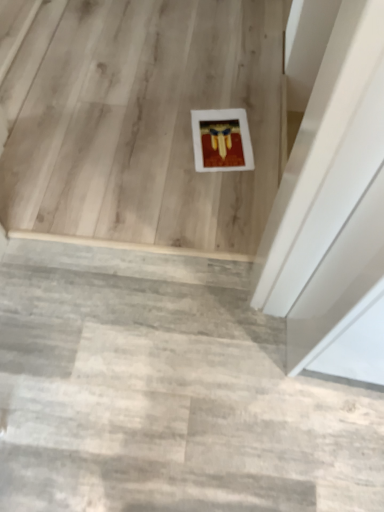
Question: Is concrete textured stairs at center, the 1th stairwell positioned from the bottom, far from white matte frame at center, acting as the first stairwell starting from the back?

Choices:
 (A) yes
 (B) no

Answer: (B)

Question: Does concrete textured stairs at center, the 1th stairwell positioned from the bottom, have a greater height compared to white matte frame at center, positioned as the 1th stairwell in top-to-bottom order?

Choices:
 (A) no
 (B) yes

Answer: (A)

Question: Considering the relative positions of concrete textured stairs at center, the 1th stairwell positioned from the bottom, and white matte frame at center, the second stairwell positioned from the front, in the image provided, is concrete textured stairs at center, the 1th stairwell positioned from the bottom, to the right of white matte frame at center, the second stairwell positioned from the front, from the viewer's perspective?

Choices:
 (A) yes
 (B) no

Answer: (A)

Question: Can you confirm if concrete textured stairs at center, the 1th stairwell positioned from the bottom, is smaller than white matte frame at center, acting as the first stairwell starting from the back?

Choices:
 (A) yes
 (B) no

Answer: (A)

Question: Are concrete textured stairs at center, the second stairwell viewed from the back, and white matte frame at center, acting as the first stairwell starting from the back, beside each other?

Choices:
 (A) no
 (B) yes

Answer: (A)

Question: Does concrete textured stairs at center, the second stairwell viewed from the back, turn towards white matte frame at center, positioned as the 1th stairwell in top-to-bottom order?

Choices:
 (A) no
 (B) yes

Answer: (B)

Question: Is the position of white matte frame at center, positioned as the 1th stairwell in top-to-bottom order, more distant than that of concrete textured stairs at center, the 1th stairwell positioned from the bottom?

Choices:
 (A) yes
 (B) no

Answer: (A)

Question: Can you confirm if white matte frame at center, the 2th stairwell in the bottom-to-top sequence, is shorter than concrete textured stairs at center, the 1th stairwell positioned from the bottom?

Choices:
 (A) no
 (B) yes

Answer: (A)

Question: Considering the relative sizes of white matte frame at center, the second stairwell positioned from the front, and concrete textured stairs at center, the 1th stairwell in the front-to-back sequence, in the image provided, is white matte frame at center, the second stairwell positioned from the front, thinner than concrete textured stairs at center, the 1th stairwell in the front-to-back sequence,?

Choices:
 (A) no
 (B) yes

Answer: (A)

Question: From the image's perspective, is white matte frame at center, the second stairwell positioned from the front, on concrete textured stairs at center, the 1th stairwell positioned from the bottom?

Choices:
 (A) no
 (B) yes

Answer: (B)

Question: From a real-world perspective, is white matte frame at center, the second stairwell positioned from the front, over concrete textured stairs at center, the 1th stairwell positioned from the bottom?

Choices:
 (A) yes
 (B) no

Answer: (B)

Question: Is white matte frame at center, the second stairwell positioned from the front, not inside concrete textured stairs at center, the 2th stairwell when ordered from top to bottom?

Choices:
 (A) yes
 (B) no

Answer: (A)

Question: From a real-world perspective, is concrete textured stairs at center, the second stairwell viewed from the back, above or below white matte frame at center, the 2th stairwell in the bottom-to-top sequence?

Choices:
 (A) above
 (B) below

Answer: (A)